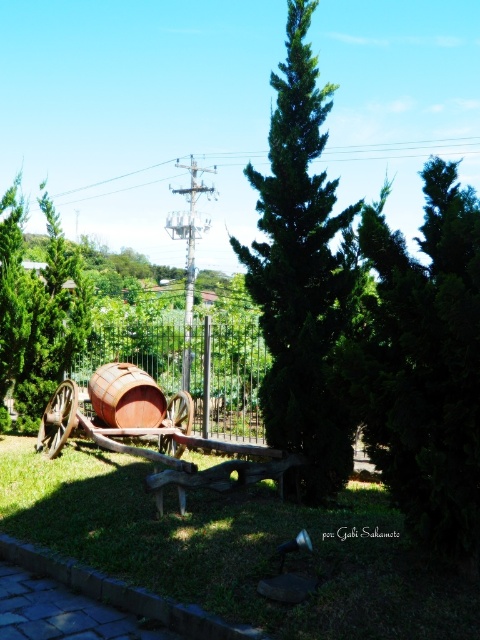
Question: Which object is the farthest from the dark green textured tree at center?

Choices:
 (A) green leafy tree at left
 (B) rusty metal barrel at center
 (C) metallic wire at upper center

Answer: (A)

Question: Does dark green textured tree at center have a lesser width compared to metallic wire at upper center?

Choices:
 (A) yes
 (B) no

Answer: (A)

Question: Estimate the real-world distances between objects in this image. Which object is closer to the green leafy tree at center?

Choices:
 (A) rusty metal barrel at center
 (B) green grass at center
 (C) metallic wire at upper center

Answer: (B)

Question: Is dark green textured tree at center to the right of metallic wire at upper center from the viewer's perspective?

Choices:
 (A) no
 (B) yes

Answer: (A)

Question: From the image, what is the correct spatial relationship of green grass at center in relation to green leafy tree at left?

Choices:
 (A) below
 (B) above

Answer: (A)

Question: Which of the following is the closest to the observer?

Choices:
 (A) dark green textured tree at center
 (B) metallic wire at upper center
 (C) green grass at center
 (D) rusty metal barrel at center

Answer: (C)